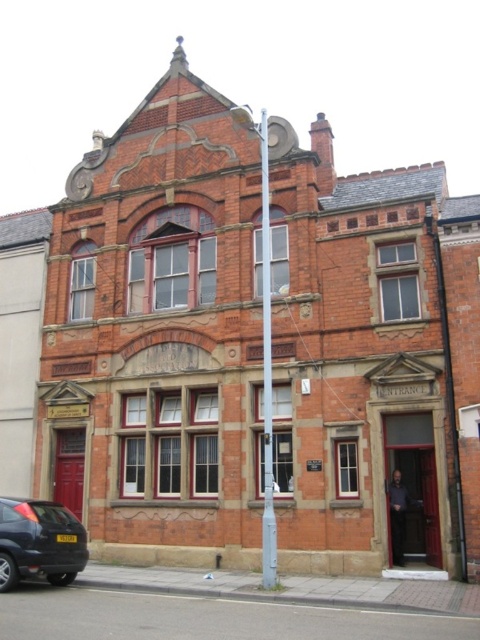
Is matte black car at lower left to the right of metallic pole at center from the viewer's perspective?

No, matte black car at lower left is not to the right of metallic pole at center.

Who is lower down, matte black car at lower left or metallic pole at center?

Positioned lower is matte black car at lower left.

Between point (49, 576) and point (259, 131), which one is positioned behind?

The point (259, 131) is more distant.

In order to click on matte black car at lower left in this screenshot , I will do `click(38, 541)`.